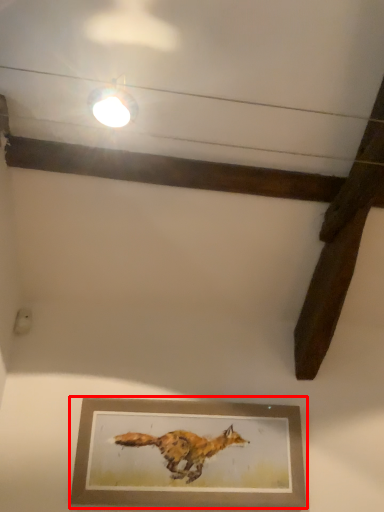
Question: From the image's perspective, where is picture frame (annotated by the red box) located relative to light fixture?

Choices:
 (A) above
 (B) below

Answer: (B)